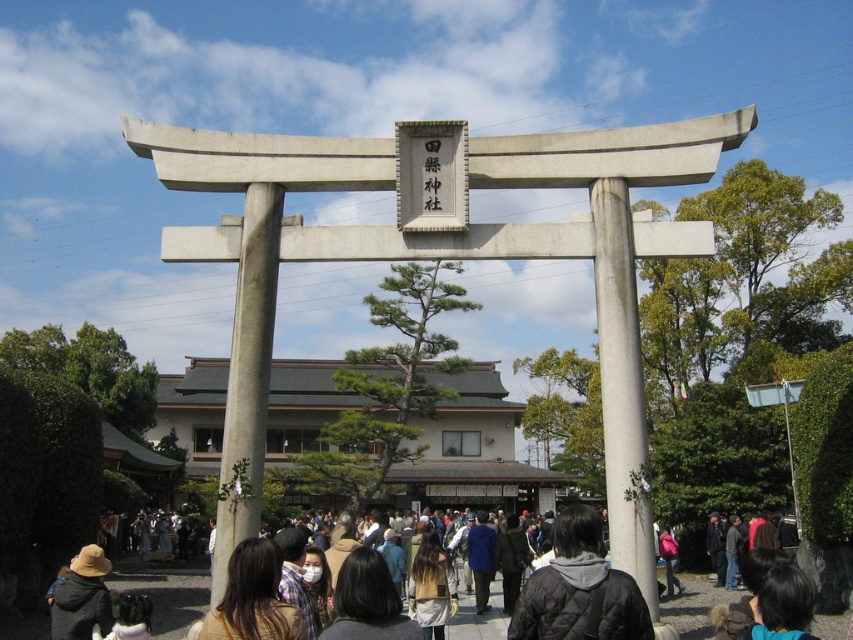
You are standing in front of the torii gate and notice a person wearing a black quilted jacket at center and has black hair at lower center. From your perspective, which item is closer to you?

The black quilted jacket at center is closer to you because it is in front of the black hair at lower center.

You are a photographer taking a picture of the shrine. You notice two people in the scene, one with dark gray hair at center and another with black hair at lower center. Which person will appear bigger in your photo?

The dark gray hair at center will appear bigger in the photo because it has a larger size compared to the black hair at lower center.

You are standing at the base of the torii gate and want to place a matte brown hat at lower left and black hair at lower center in such a way that they are both visible from your current position. Given their distance apart, will you be able to see both objects simultaneously without moving your head?

The matte brown hat at lower left is 96.22 feet away from black hair at lower center. Since the distance between them is quite large, you might not be able to see both objects simultaneously without moving your head due to the significant separation between them.